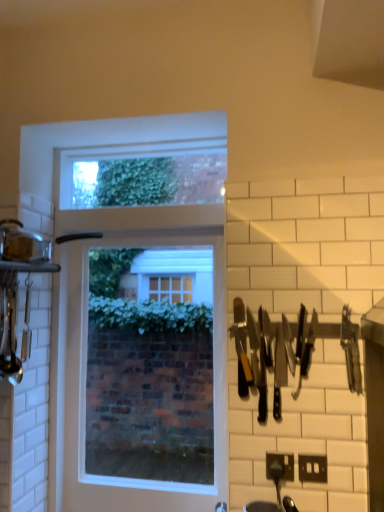
Locate an element on the screen. black plastic electric outlet at lower right is located at coordinates (312, 468).

Image resolution: width=384 pixels, height=512 pixels. Identify the location of black plastic knives at right. (270, 353).

Locate an element on the screen. Image resolution: width=384 pixels, height=512 pixels. black plastic electric outlet at lower right is located at coordinates (312, 468).

Could you tell me if clear glass window at center is turned towards black plastic knives at right?

No, clear glass window at center is not turned towards black plastic knives at right.

Consider the image. From the image's perspective, between clear glass window at center and black plastic knives at right, which one is located above?

black plastic knives at right, from the image's perspective.

The image size is (384, 512). Find the location of `window on the left of black plastic knives at right`. window on the left of black plastic knives at right is located at coordinates (87, 350).

Can you confirm if clear glass window at center is shorter than black plastic electric outlet at lower right?

No, clear glass window at center is not shorter than black plastic electric outlet at lower right.

From a real-world perspective, which is physically above, clear glass window at center or black plastic electric outlet at lower right?

clear glass window at center, from a real-world perspective.

From the image's perspective, is clear glass window at center above or below black plastic electric outlet at lower right?

clear glass window at center is situated higher than black plastic electric outlet at lower right in the image.

Is clear glass window at center thinner than black plastic electric outlet at lower right?

No.

Is black plastic electric outlet at lower right to the left or to the right of black plastic knives at right in the image?

black plastic electric outlet at lower right is to the right of black plastic knives at right.

Can you tell me how much black plastic electric outlet at lower right and black plastic knives at right differ in facing direction?

The angular difference between black plastic electric outlet at lower right and black plastic knives at right is 1.83 degrees.

Is black plastic electric outlet at lower right wider or thinner than black plastic knives at right?

black plastic electric outlet at lower right is thinner than black plastic knives at right.

Which is behind, black plastic knives at right or black plastic electric outlet at lower right?

black plastic electric outlet at lower right is further away from the camera.

Is black plastic knives at right to the left or to the right of black plastic electric outlet at lower right in the image?

black plastic knives at right is positioned on black plastic electric outlet at lower right's left side.

From the image's perspective, which object appears higher, black plastic knives at right or black plastic electric outlet at lower right?

black plastic knives at right is shown above in the image.

From the image's perspective, would you say black plastic electric outlet at lower right is shown under clear glass window at center?

Yes.

Between black plastic electric outlet at lower right and clear glass window at center, which one has smaller size?

black plastic electric outlet at lower right.

Which of these two, black plastic electric outlet at lower right or clear glass window at center, stands taller?

clear glass window at center is taller.

Can you tell me how much black plastic electric outlet at lower right and clear glass window at center differ in facing direction?

The angular difference between black plastic electric outlet at lower right and clear glass window at center is 3.21 degrees.

Who is taller, black plastic knives at right or clear glass window at center?

With more height is clear glass window at center.

From a real-world perspective, which object rests below the other?

From a 3D spatial view, clear glass window at center is below.

Is black plastic knives at right in contact with clear glass window at center?

No.

Do you think black plastic knives at right is within clear glass window at center, or outside of it?

black plastic knives at right is not enclosed by clear glass window at center.

I want to click on window below the black plastic knives at right (from the image's perspective), so click(87, 350).

The image size is (384, 512). I want to click on window that is above the black plastic electric outlet at lower right (from the image's perspective), so click(87, 350).

Which object lies nearer to the anchor point black plastic knives at right, black plastic electric outlet at lower right or clear glass window at center?

black plastic electric outlet at lower right is closer to black plastic knives at right.

From the image, which object appears to be nearer to black plastic knives at right, clear glass window at center or black plastic electric outlet at lower right?

black plastic electric outlet at lower right is closer to black plastic knives at right.

Looking at the image, which one is located closer to clear glass window at center, black plastic electric outlet at lower right or black plastic knives at right?

black plastic knives at right lies closer to clear glass window at center than the other object.

Based on their spatial positions, is black plastic knives at right or black plastic electric outlet at lower right closer to clear glass window at center?

The object closer to clear glass window at center is black plastic knives at right.

Estimate the real-world distances between objects in this image. Which object is closer to black plastic electric outlet at lower right, black plastic knives at right or clear glass window at center?

Based on the image, black plastic knives at right appears to be nearer to black plastic electric outlet at lower right.

Looking at the image, which one is located further to black plastic electric outlet at lower right, clear glass window at center or black plastic knives at right?

Among the two, clear glass window at center is located further to black plastic electric outlet at lower right.

Locate an element on the screen. cutlery between clear glass window at center and black plastic electric outlet at lower right from left to right is located at coordinates (270, 353).